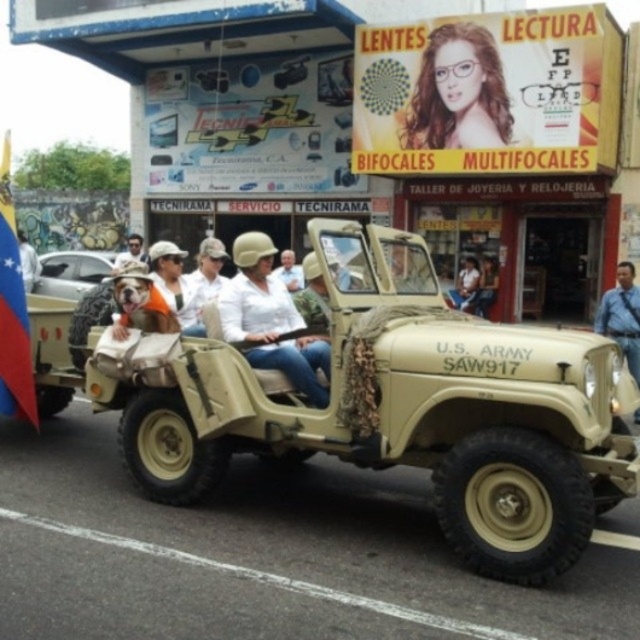
You are a photographer at the parade. You want to capture a photo where the white fabric flag at left is positioned above the matte white helmet at upper center in the frame. Is this possible given their current arrangement?

The white fabric flag at left is located below the matte white helmet at upper center, so it is not possible to position it above in the current arrangement.